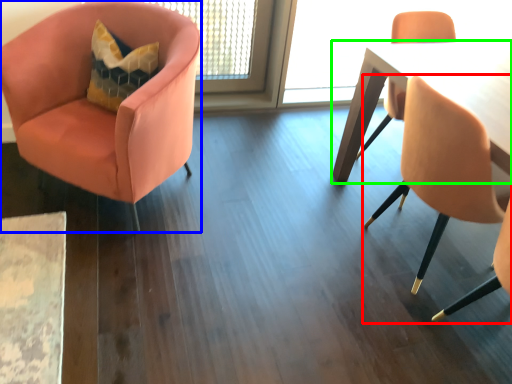
Question: Estimate the real-world distances between objects in this image. Which object is farther from chair (highlighted by a red box), chair (highlighted by a blue box) or table (highlighted by a green box)?

Choices:
 (A) chair
 (B) table

Answer: (A)